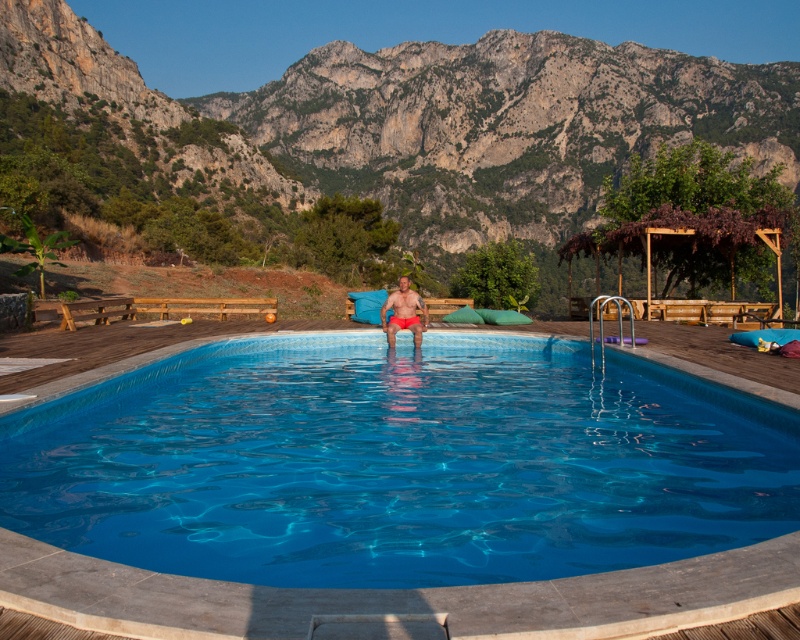
Between blue glossy pool at center and rocky cliff at upper center, which one has less height?

With less height is blue glossy pool at center.

Which is behind, point (786, 426) or point (68, 28)?

Positioned behind is point (68, 28).

Is point (134, 433) positioned before point (582, 58)?

Yes, point (134, 433) is in front of point (582, 58).

Where is `blue glossy pool at center`? blue glossy pool at center is located at coordinates (398, 464).

Which of these two, blue glossy pool at center or matte red shorts at center, stands shorter?

matte red shorts at center

Is point (545, 464) closer to camera compared to point (413, 340)?

Yes, it is in front of point (413, 340).

Locate an element on the screen. The image size is (800, 640). blue glossy pool at center is located at coordinates (398, 464).

From the picture: Does rocky cliff at upper center appear over matte red shorts at center?

Indeed, rocky cliff at upper center is positioned over matte red shorts at center.

Is point (674, 68) less distant than point (397, 316)?

No.

You are a GUI agent. You are given a task and a screenshot of the screen. Output one action in this format:
    pyautogui.click(x=<x>, y=<y>)
    Task: Click on the rocky cliff at upper center
    The image size is (800, 640).
    Given the screenshot: What is the action you would take?
    pyautogui.click(x=424, y=120)